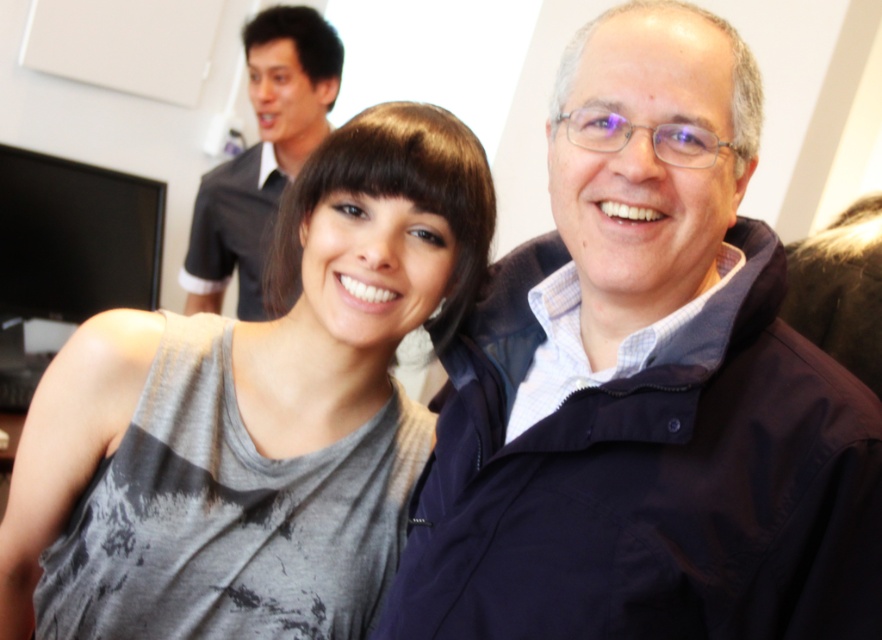
Is point (477, 586) positioned before point (267, 140)?

Yes.

What do you see at coordinates (645, 387) in the screenshot?
I see `navy blue jacket at center` at bounding box center [645, 387].

The image size is (882, 640). In order to click on navy blue jacket at center in this screenshot , I will do `click(645, 387)`.

Locate an element on the screen. This screenshot has width=882, height=640. navy blue jacket at center is located at coordinates (645, 387).

This screenshot has height=640, width=882. Identify the location of navy blue jacket at center. (645, 387).

Does navy blue jacket at center appear under gray matte tank top at center?

Actually, navy blue jacket at center is above gray matte tank top at center.

Image resolution: width=882 pixels, height=640 pixels. I want to click on navy blue jacket at center, so click(x=645, y=387).

Can you confirm if gray matte tank top at center is thinner than dark gray shirt at upper left?

No.

The height and width of the screenshot is (640, 882). What do you see at coordinates (354, 324) in the screenshot? I see `gray matte tank top at center` at bounding box center [354, 324].

Identify the location of gray matte tank top at center. The width and height of the screenshot is (882, 640). (354, 324).